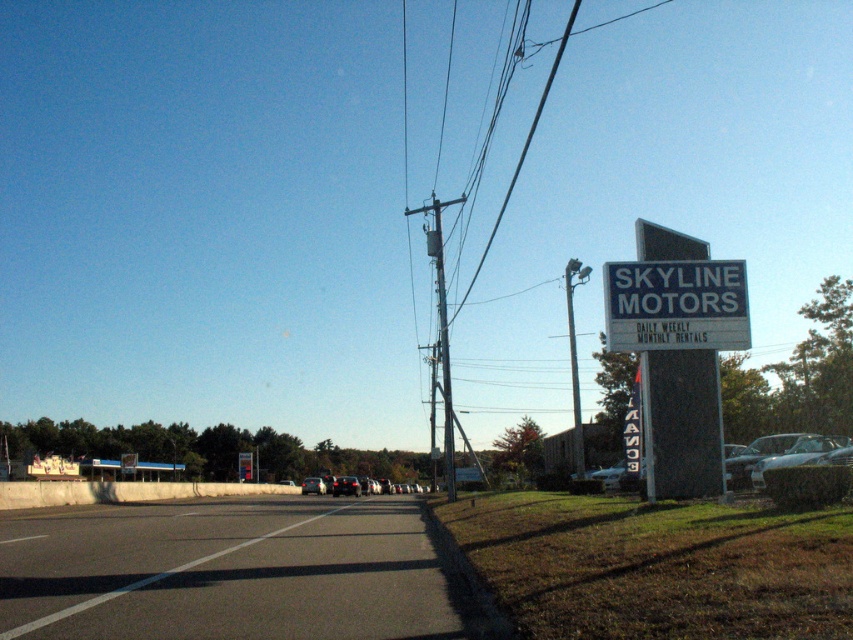
Question: Can you confirm if metallic gray pole at upper right is bigger than matte black car at center?

Choices:
 (A) no
 (B) yes

Answer: (B)

Question: Estimate the real-world distances between objects in this image. Which object is closer to the camouflage-patterned car at right?

Choices:
 (A) black asphalt highway at lower left
 (B) metallic gray pole at upper right

Answer: (A)

Question: Is shiny silver sedan at center further to camera compared to matte black car at center?

Choices:
 (A) yes
 (B) no

Answer: (B)

Question: Which point is closer to the camera?

Choices:
 (A) (734, 336)
 (B) (357, 481)
 (C) (317, 481)
 (D) (811, 442)

Answer: (A)

Question: Based on their relative distances, which object is farther from the white plastic sign at upper right?

Choices:
 (A) metallic gray utility pole at center
 (B) silver metallic car at center
 (C) metallic gray pole at upper right
 (D) matte black car at center

Answer: (D)

Question: Does camouflage-patterned car at right appear on the right side of shiny silver sedan at center?

Choices:
 (A) no
 (B) yes

Answer: (B)